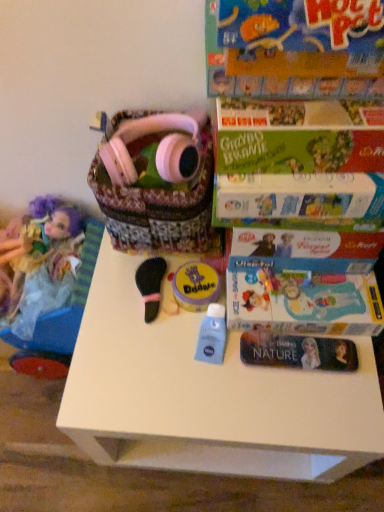
Where is `free space between pink fabric basket at upper center and black felt brush at center, positioned as the second toy in right-to-left order`? The height and width of the screenshot is (512, 384). free space between pink fabric basket at upper center and black felt brush at center, positioned as the second toy in right-to-left order is located at coordinates (128, 298).